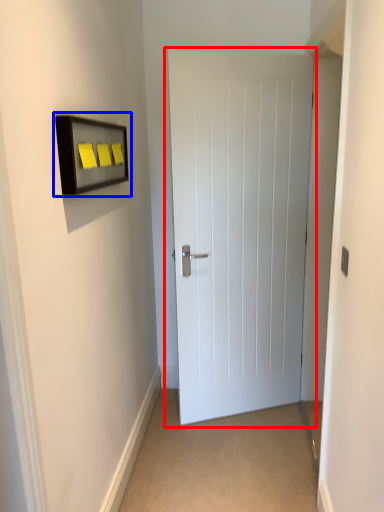
Question: Which object is further to the camera taking this photo, door (highlighted by a red box) or medicine cabinet (highlighted by a blue box)?

Choices:
 (A) door
 (B) medicine cabinet

Answer: (A)